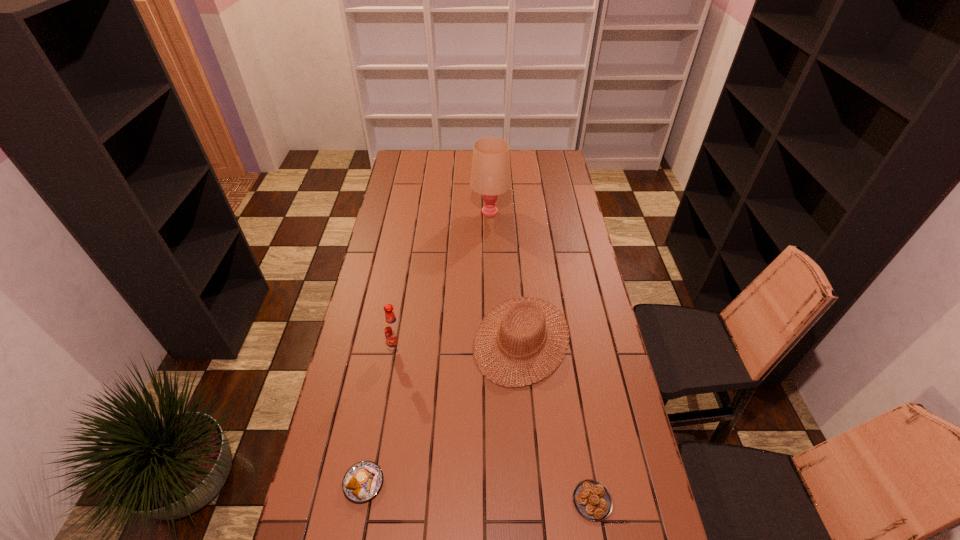
Where is `vacant region located 0.170m on the left of the third shortest object`? Image resolution: width=960 pixels, height=540 pixels. vacant region located 0.170m on the left of the third shortest object is located at coordinates [x=424, y=339].

Find the location of a particular element. The width and height of the screenshot is (960, 540). vacant position located on the right of the taller pastry is located at coordinates (x=498, y=483).

You are a GUI agent. You are given a task and a screenshot of the screen. Output one action in this format:
    pyautogui.click(x=<x>, y=<y>)
    Task: Click on the vacant area situated 0.080m on the right of the shortest object
    This screenshot has width=960, height=540.
    Given the screenshot: What is the action you would take?
    pyautogui.click(x=642, y=501)

Where is `root beer that is at the left edge`? root beer that is at the left edge is located at coordinates (393, 330).

The image size is (960, 540). What are the coordinates of `pastry situated at the left edge` in the screenshot? It's located at (363, 480).

In order to click on sunhat positioned at the right edge in this screenshot , I will do `click(537, 311)`.

Locate an element on the screen. The width and height of the screenshot is (960, 540). pastry at the right edge is located at coordinates (592, 499).

You are a GUI agent. You are given a task and a screenshot of the screen. Output one action in this format:
    pyautogui.click(x=<x>, y=<y>)
    Task: Click on the vacant space at the left edge of the desktop
    The height and width of the screenshot is (540, 960).
    Given the screenshot: What is the action you would take?
    pyautogui.click(x=406, y=215)

In order to click on vacant area at the right edge of the desktop in this screenshot , I will do `click(559, 197)`.

The height and width of the screenshot is (540, 960). I want to click on free spot at the far left corner of the desktop, so 414,151.